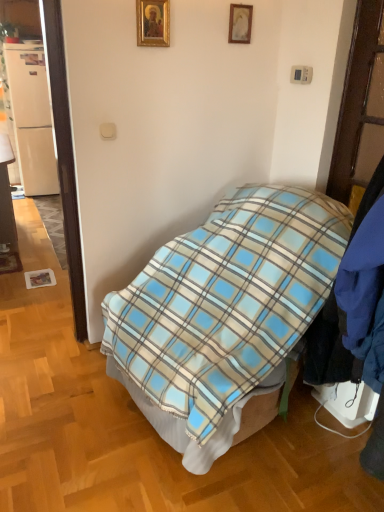
Question: In which direction should I rotate to look at gold-framed picture at upper center, the 1th picture frame in the left-to-right sequence?

Choices:
 (A) right
 (B) left

Answer: (B)

Question: Can you confirm if wooden picture frame at upper center, marked as the 2th picture frame in a front-to-back arrangement, is shorter than matte wood desk at left?

Choices:
 (A) yes
 (B) no

Answer: (A)

Question: From the image's perspective, is wooden picture frame at upper center, marked as the 2th picture frame in a front-to-back arrangement, below matte wood desk at left?

Choices:
 (A) yes
 (B) no

Answer: (B)

Question: Does wooden picture frame at upper center, which appears as the first picture frame when viewed from the right, lie in front of matte wood desk at left?

Choices:
 (A) yes
 (B) no

Answer: (A)

Question: Is wooden picture frame at upper center, which appears as the first picture frame when viewed from the right, wider than matte wood desk at left?

Choices:
 (A) yes
 (B) no

Answer: (B)

Question: Is wooden picture frame at upper center, which appears as the first picture frame when viewed from the right, outside of matte wood desk at left?

Choices:
 (A) no
 (B) yes

Answer: (B)

Question: From a real-world perspective, is wooden picture frame at upper center, placed as the 1th picture frame when sorted from back to front, positioned over matte wood desk at left based on gravity?

Choices:
 (A) no
 (B) yes

Answer: (B)

Question: Can you confirm if matte wood desk at left is thinner than white matte refrigerator at left?

Choices:
 (A) yes
 (B) no

Answer: (A)

Question: Considering the relative positions of matte wood desk at left and white matte refrigerator at left in the image provided, is matte wood desk at left to the right of white matte refrigerator at left from the viewer's perspective?

Choices:
 (A) no
 (B) yes

Answer: (B)

Question: Does matte wood desk at left come behind white matte refrigerator at left?

Choices:
 (A) no
 (B) yes

Answer: (A)

Question: Are matte wood desk at left and white matte refrigerator at left far apart?

Choices:
 (A) no
 (B) yes

Answer: (B)

Question: Does matte wood desk at left appear on the left side of white matte refrigerator at left?

Choices:
 (A) no
 (B) yes

Answer: (A)

Question: From a real-world perspective, is matte wood desk at left under white matte refrigerator at left?

Choices:
 (A) yes
 (B) no

Answer: (A)

Question: Does blue plaid blanket at center lie in front of matte wood desk at left?

Choices:
 (A) yes
 (B) no

Answer: (A)